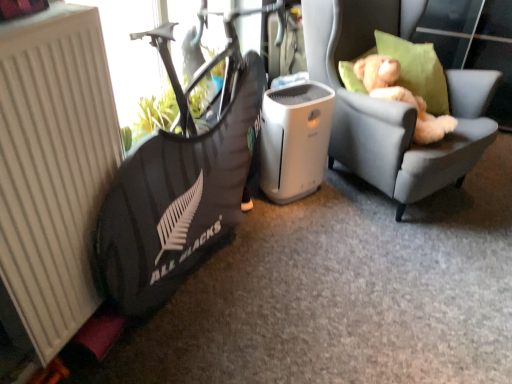
Question: From the image's perspective, is black fabric bean bag chair at left above or below light gray fabric chair at right?

Choices:
 (A) below
 (B) above

Answer: (A)

Question: In terms of size, does black fabric bean bag chair at left appear bigger or smaller than light gray fabric chair at right?

Choices:
 (A) big
 (B) small

Answer: (B)

Question: Which object is the farthest from the white plastic air purifier at center?

Choices:
 (A) black fabric bean bag chair at left
 (B) light gray fabric chair at right
 (C) light brown plush teddy bear at upper right
 (D) white matte radiator at left

Answer: (D)

Question: Which object is the farthest from the light gray fabric chair at right?

Choices:
 (A) white matte radiator at left
 (B) white plastic air purifier at center
 (C) black fabric bean bag chair at left
 (D) light brown plush teddy bear at upper right

Answer: (A)